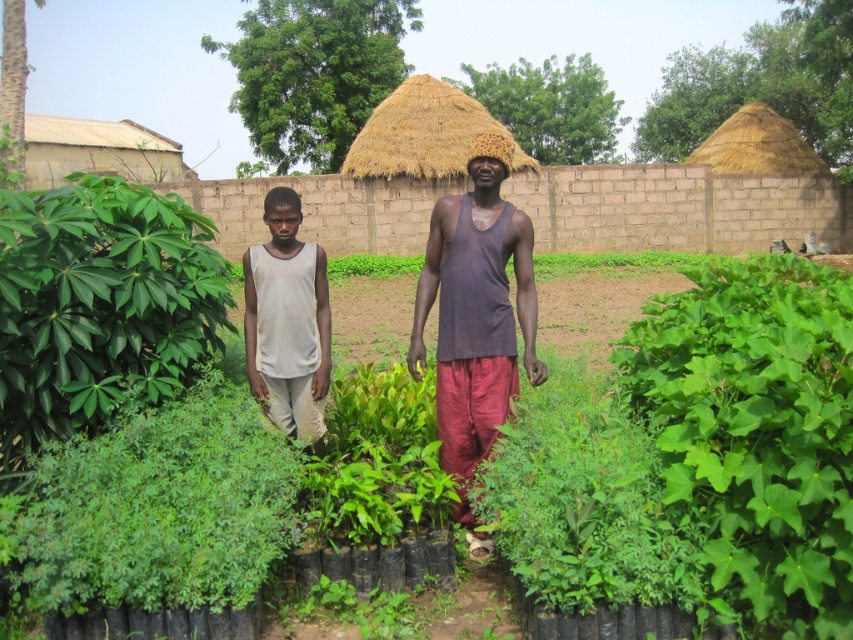
You are a gardener who needs to determine which object is bigger between the green leafy plant at left and the matte brown tank top at center. Which one is larger?

The green leafy plant at left is larger compared to the matte brown tank top at center according to the description.